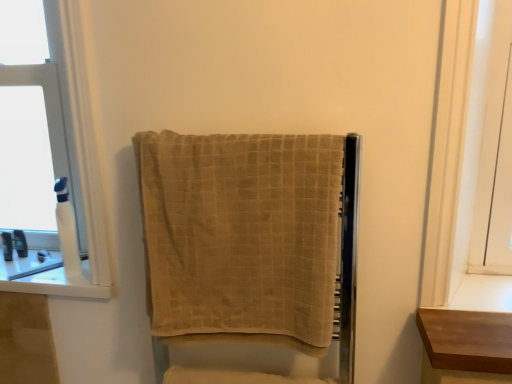
Question: Is beige textured towel at center situated inside translucent plastic bottle at left, which ranks as the 3th toiletry in front-to-back order, or outside?

Choices:
 (A) inside
 (B) outside

Answer: (B)

Question: Is beige textured towel at center taller or shorter than translucent plastic bottle at left, the second toiletry positioned from the right?

Choices:
 (A) short
 (B) tall

Answer: (B)

Question: Based on their relative distances, which object is nearer to the white plastic bottle at left?

Choices:
 (A) translucent plastic bottle at left, the 1th toiletry positioned from the left
 (B) white plastic bottle at left, the first toiletry from the front
 (C) translucent plastic bottle at left, the second toiletry positioned from the right
 (D) light brown wood shelf at right
 (E) white glossy window sill at left

Answer: (B)

Question: Estimate the real-world distances between objects in this image. Which object is closer to the translucent plastic bottle at left, the second toiletry from the back?

Choices:
 (A) white plastic bottle at left
 (B) beige textured towel at center
 (C) white plastic bottle at left, acting as the third toiletry starting from the back
 (D) light brown wood shelf at right
 (E) translucent plastic bottle at left, acting as the first toiletry starting from the back

Answer: (E)